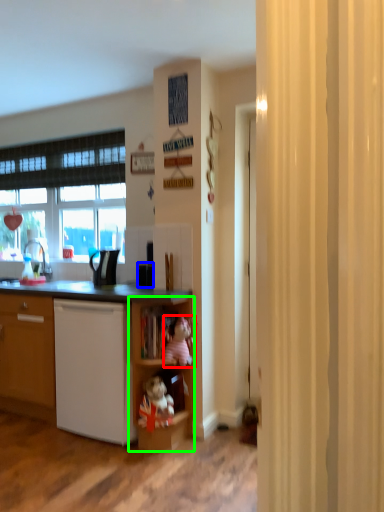
Question: Considering the real-world distances, which object is farthest from toy (highlighted by a red box)? appliance (highlighted by a blue box) or shelf (highlighted by a green box)?

Choices:
 (A) appliance
 (B) shelf

Answer: (A)